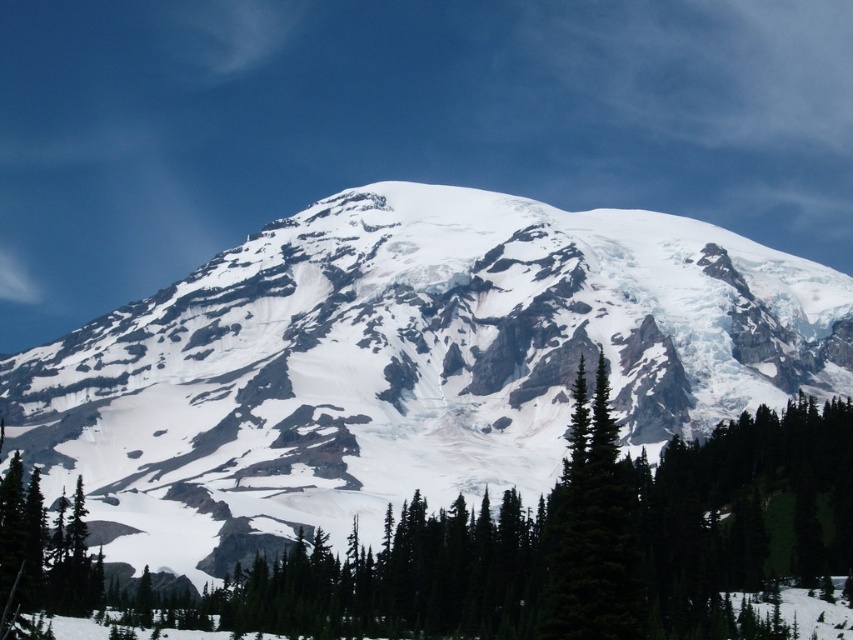
You are standing at the point marked as point (405, 364) on the image. What is the terrain like under your feet?

The terrain under your feet at point (405, 364) is white snow, as the point is located on the white snow covered mountain at center.